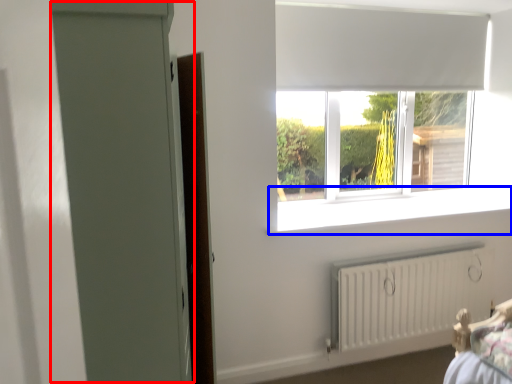
Question: Among these objects, which one is nearest to the camera, screen door (highlighted by a red box) or window sill (highlighted by a blue box)?

Choices:
 (A) screen door
 (B) window sill

Answer: (A)